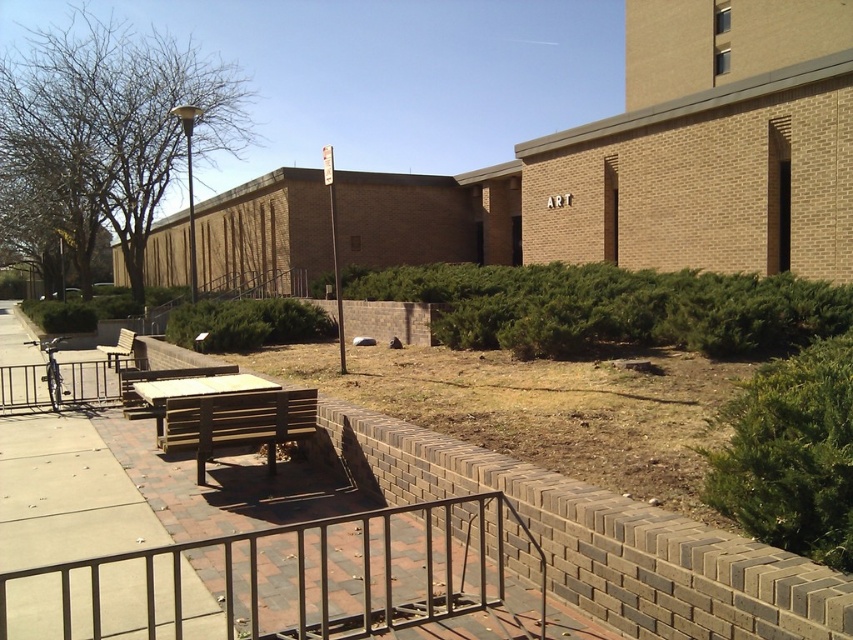
Between wooden bench at center and wooden park bench at left, which one appears on the left side from the viewer's perspective?

wooden park bench at left is more to the left.

Can you confirm if wooden bench at center is smaller than wooden park bench at left?

Yes.

Which is in front, point (225, 404) or point (131, 332)?

Positioned in front is point (225, 404).

Where is `wooden bench at center`? This screenshot has width=853, height=640. wooden bench at center is located at coordinates (236, 422).

Which of these two, wooden bench at center or green shrub at center, stands shorter?

green shrub at center is shorter.

Who is positioned more to the left, wooden bench at center or green shrub at center?

green shrub at center is more to the left.

Describe the element at coordinates (236, 422) in the screenshot. The image size is (853, 640). I see `wooden bench at center` at that location.

This screenshot has width=853, height=640. Find the location of `wooden bench at center`. wooden bench at center is located at coordinates (236, 422).

Is wooden picnic table at center taller than wooden park bench at center?

Indeed, wooden picnic table at center has a greater height compared to wooden park bench at center.

Does wooden picnic table at center lie behind wooden park bench at center?

No.

This screenshot has width=853, height=640. I want to click on wooden picnic table at center, so point(196,388).